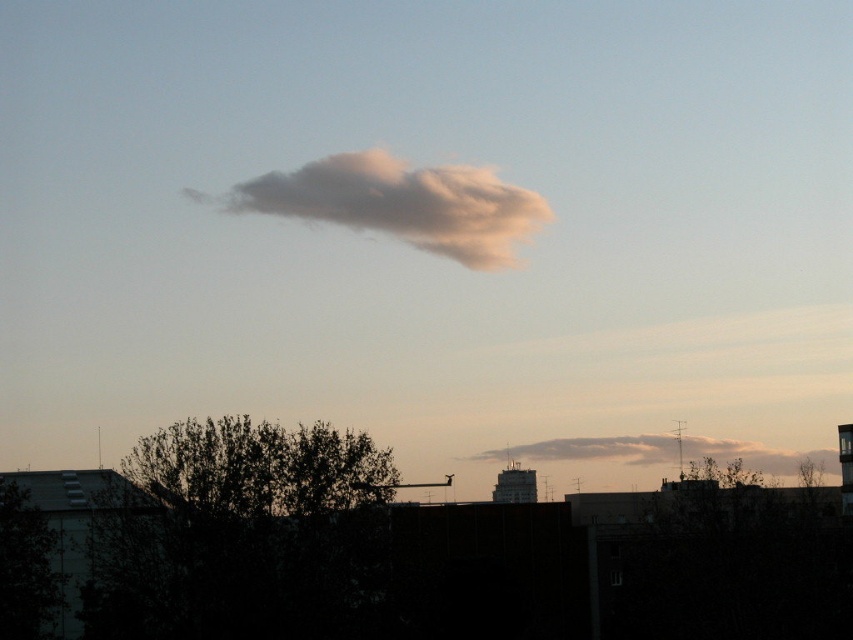
Question: Which point appears closest to the camera in this image?

Choices:
 (A) (231, 618)
 (B) (576, 438)
 (C) (283, 451)
 (D) (340, 173)

Answer: (A)

Question: Which point is farther to the camera?

Choices:
 (A) (752, 445)
 (B) (508, 264)
 (C) (300, 531)
 (D) (277, 442)

Answer: (A)

Question: Is the position of dark green leafy tree at lower center more distant than that of fuzzy white cloud at upper center?

Choices:
 (A) no
 (B) yes

Answer: (A)

Question: Does silhouette leafy tree at center appear on the left side of fuzzy white cloud at center?

Choices:
 (A) yes
 (B) no

Answer: (A)

Question: Which object appears closest to the camera in this image?

Choices:
 (A) dark green leafy tree at lower center
 (B) silhouette leafy tree at center

Answer: (A)

Question: Is fuzzy white cloud at upper center smaller than silhouette leafy tree at center?

Choices:
 (A) yes
 (B) no

Answer: (B)